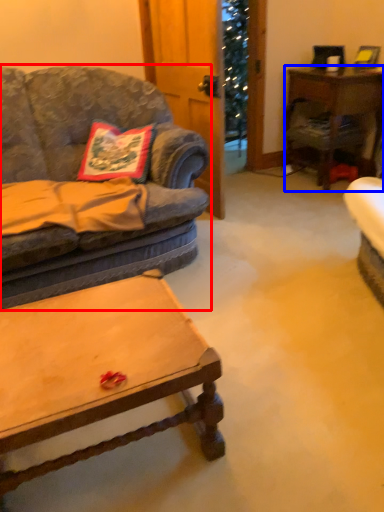
Question: Which object is further to the camera taking this photo, studio couch (highlighted by a red box) or desk (highlighted by a blue box)?

Choices:
 (A) studio couch
 (B) desk

Answer: (B)